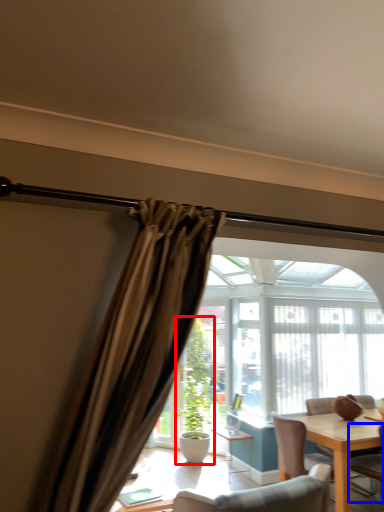
Question: Among these objects, which one is nearest to the camera, houseplant (highlighted by a red box) or chair (highlighted by a blue box)?

Choices:
 (A) houseplant
 (B) chair

Answer: (B)